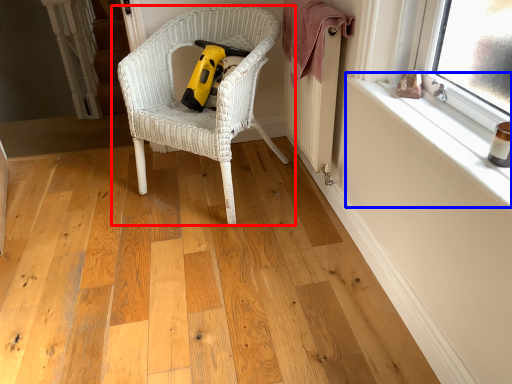
Question: Which point is further to the camera, chair (highlighted by a red box) or window sill (highlighted by a blue box)?

Choices:
 (A) chair
 (B) window sill

Answer: (A)